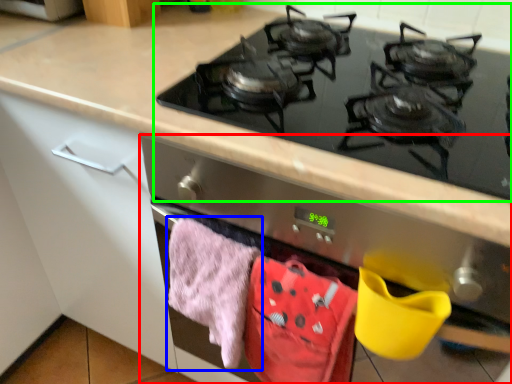
Question: Which object is the closest to the oven (highlighted by a red box)? Choose among these: beach towel (highlighted by a blue box) or gas stove (highlighted by a green box).

Choices:
 (A) beach towel
 (B) gas stove

Answer: (A)